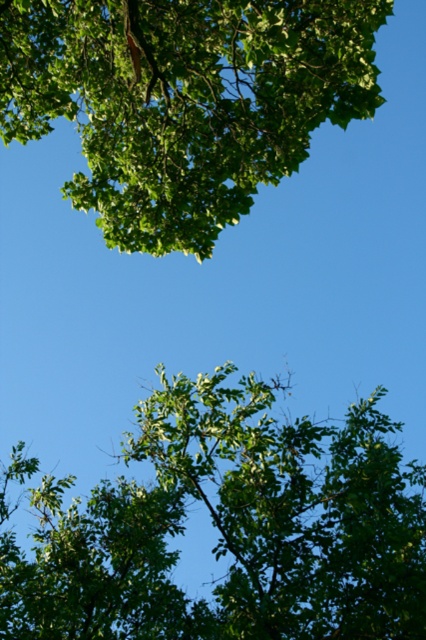
You are standing in a forest and want to take a photo of both the green leafy tree at upper center and the green leafy tree at upper left. Which tree should you focus on first to ensure both are in the frame?

You should focus on the green leafy tree at upper left first because it is closer to you than the green leafy tree at upper center, which is further away, ensuring both are in the frame.

You are a bird looking for a place to perch. You see the green leafy tree at upper center and the green leafy tree at upper left. Which tree is closer to you?

The green leafy tree at upper left is closer to you since the distance between you and the green leafy tree at upper center is 9.24 feet, making it farther than the green leafy tree at upper left.

Based on the photo, you are standing in a forest clearing and see a point marked at coordinates (230,529). Which object in the scene corresponds to this point?

The point at coordinates (230,529) corresponds to the green leafy tree at upper center.